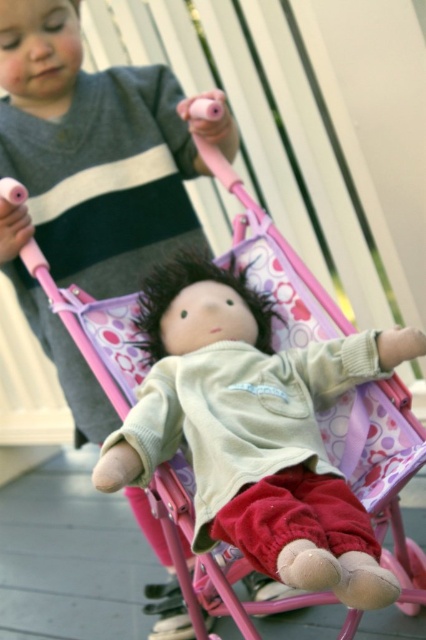
Who is positioned more to the right, velvety beige doll at center or matte gray shirt at upper left?

From the viewer's perspective, velvety beige doll at center appears more on the right side.

Between velvety beige doll at center and matte gray shirt at upper left, which one has less height?

With less height is velvety beige doll at center.

The height and width of the screenshot is (640, 426). Describe the element at coordinates (253, 429) in the screenshot. I see `velvety beige doll at center` at that location.

This screenshot has height=640, width=426. In order to click on velvety beige doll at center in this screenshot , I will do `click(253, 429)`.